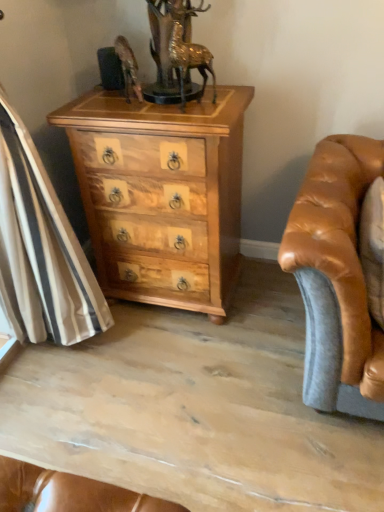
Question: Would you say natural wood chest of drawers at center is inside or outside gold metallic deer at upper center?

Choices:
 (A) inside
 (B) outside

Answer: (B)

Question: Considering the positions of natural wood chest of drawers at center and gold metallic deer at upper center in the image, is natural wood chest of drawers at center taller or shorter than gold metallic deer at upper center?

Choices:
 (A) tall
 (B) short

Answer: (A)

Question: Considering the positions of natural wood chest of drawers at center and gold metallic deer at upper center in the image, is natural wood chest of drawers at center bigger or smaller than gold metallic deer at upper center?

Choices:
 (A) small
 (B) big

Answer: (B)

Question: Considering the positions of gold metallic deer at upper center and natural wood chest of drawers at center in the image, is gold metallic deer at upper center bigger or smaller than natural wood chest of drawers at center?

Choices:
 (A) small
 (B) big

Answer: (A)

Question: From the image's perspective, relative to natural wood chest of drawers at center, is gold metallic deer at upper center above or below?

Choices:
 (A) below
 (B) above

Answer: (B)

Question: Is gold metallic deer at upper center to the left or to the right of natural wood chest of drawers at center in the image?

Choices:
 (A) right
 (B) left

Answer: (A)

Question: From a real-world perspective, is gold metallic deer at upper center physically located above or below natural wood chest of drawers at center?

Choices:
 (A) above
 (B) below

Answer: (A)